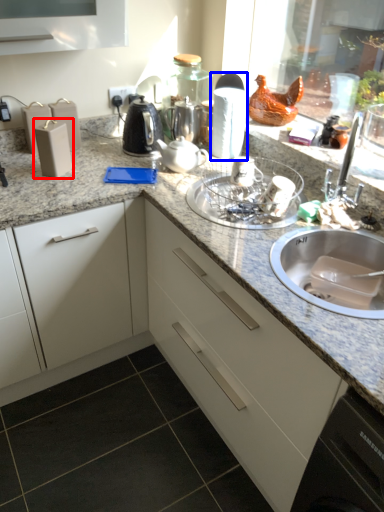
Question: Which object appears closest to the camera in this image, appliance (highlighted by a red box) or appliance (highlighted by a blue box)?

Choices:
 (A) appliance
 (B) appliance

Answer: (A)